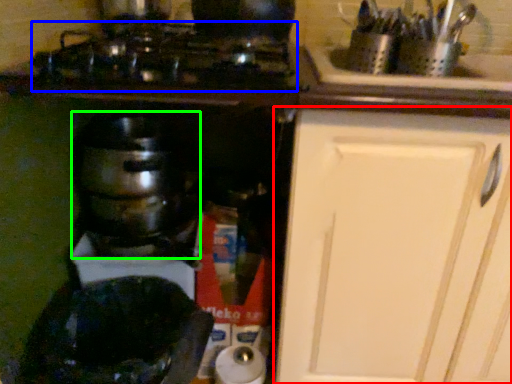
Question: Based on their relative distances, which object is nearer to cabinetry (highlighted by a red box)? Choose from gas stove (highlighted by a blue box) and kitchen appliance (highlighted by a green box).

Choices:
 (A) gas stove
 (B) kitchen appliance

Answer: (A)